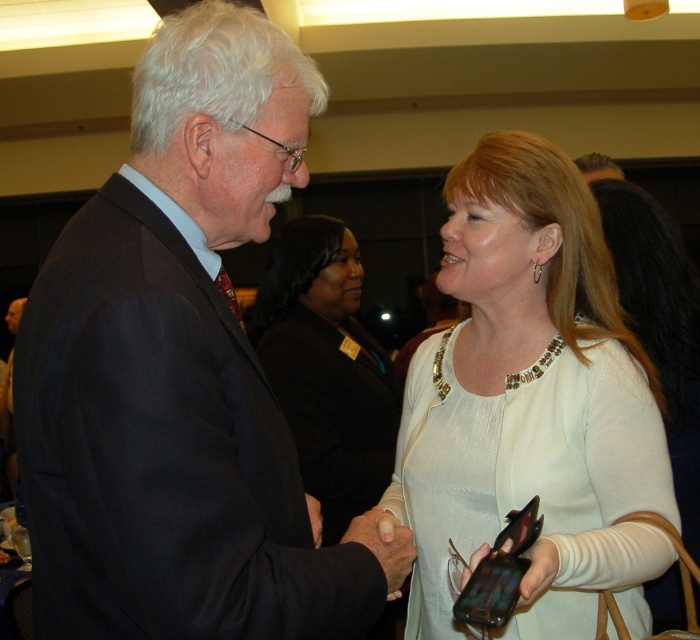
Question: Does dark blue suit at center have a smaller size compared to matte black blazer at center?

Choices:
 (A) no
 (B) yes

Answer: (B)

Question: Does dark blue suit at center appear on the left side of white beaded necklace at center?

Choices:
 (A) no
 (B) yes

Answer: (B)

Question: Among these objects, which one is farthest from the camera?

Choices:
 (A) dark blue suit at center
 (B) white beaded necklace at center
 (C) matte black blazer at center

Answer: (C)

Question: Can you confirm if dark blue suit at center is wider than matte black blazer at center?

Choices:
 (A) yes
 (B) no

Answer: (A)

Question: Which object is farther from the camera taking this photo?

Choices:
 (A) dark blue suit at center
 (B) matte black blazer at center
 (C) white beaded necklace at center

Answer: (B)

Question: Which of the following is the closest to the observer?

Choices:
 (A) white beaded necklace at center
 (B) matte black blazer at center
 (C) dark blue suit at center

Answer: (C)